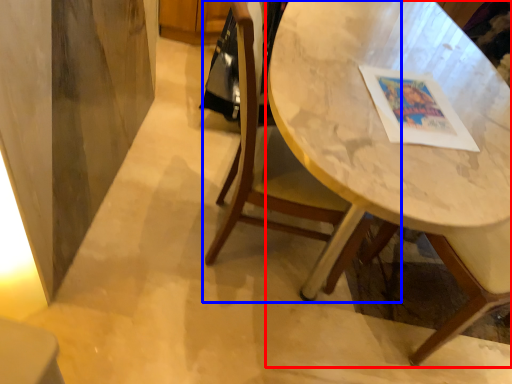
Question: Which object is closer to the camera taking this photo, table (highlighted by a red box) or chair (highlighted by a blue box)?

Choices:
 (A) table
 (B) chair

Answer: (A)